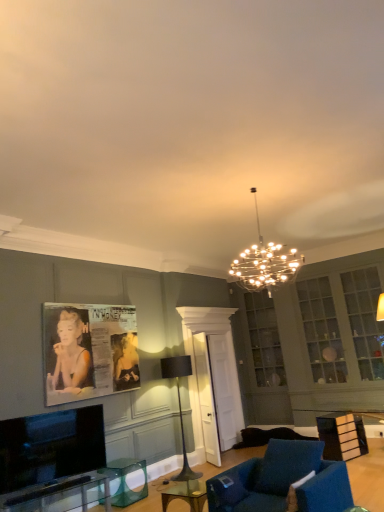
Question: Considering the positions of clear glass table at lower left, which is the 1th table in left-to-right order, and clear glass table at center, positioned as the 1th round table in front-to-back order, in the image, is clear glass table at lower left, which is the 1th table in left-to-right order, wider or thinner than clear glass table at center, positioned as the 1th round table in front-to-back order,?

Choices:
 (A) thin
 (B) wide

Answer: (A)

Question: Relative to clear glass table at center, which is the first round table in top-to-bottom order, is clear glass table at lower left, which ranks as the first table in front-to-back order, in front or behind?

Choices:
 (A) front
 (B) behind

Answer: (B)

Question: Estimate the real-world distances between objects in this image. Which object is closer to the clear glass table at lower left, which is the 1th table in left-to-right order?

Choices:
 (A) velvet blue armchair at lower center
 (B) flat screen tv at lower left
 (C) clear glass table at center, placed as the 1th round table when sorted from right to left
 (D) metallic chandelier at center, the 2th lamp positioned from the back
 (E) transparent glass door at center

Answer: (B)

Question: Estimate the real-world distances between objects in this image. Which object is farther from the metallic chandelier at center, positioned as the 1th lamp in top-to-bottom order?

Choices:
 (A) black metal floor lamp at center, the 1th lamp positioned from the back
 (B) wooden table at lower right, the 1th table from the back
 (C) flat screen tv at lower left
 (D) transparent glass door at center
 (E) clear glass table at center, acting as the 2th round table starting from the bottom

Answer: (C)